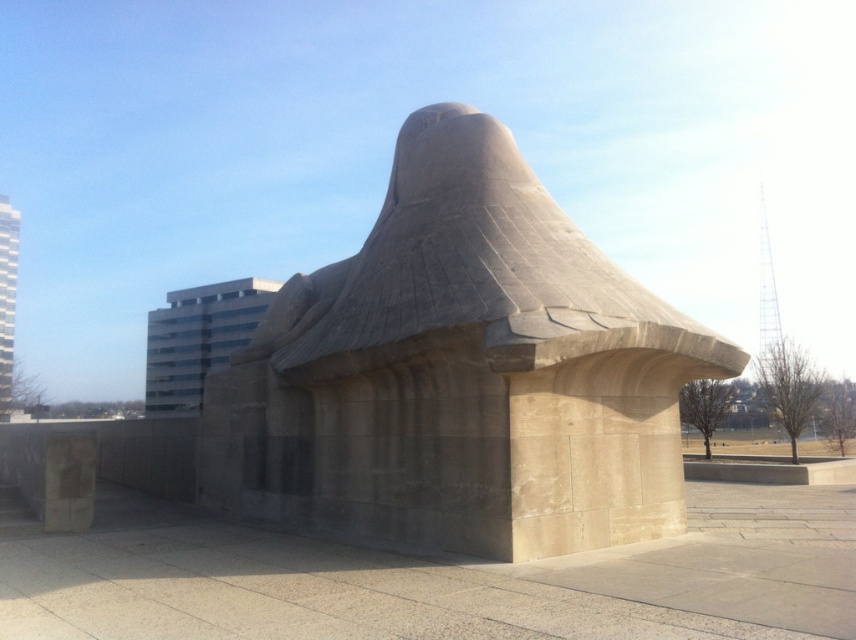
Question: Is smooth concrete sculpture at center wider than beige stone wall at center?

Choices:
 (A) yes
 (B) no

Answer: (B)

Question: Does smooth concrete sculpture at center have a lesser width compared to beige stone wall at center?

Choices:
 (A) no
 (B) yes

Answer: (B)

Question: Is smooth concrete sculpture at center to the right of beige stone wall at center from the viewer's perspective?

Choices:
 (A) yes
 (B) no

Answer: (B)

Question: Which object is farther from the camera taking this photo?

Choices:
 (A) smooth concrete sculpture at center
 (B) beige stone wall at center

Answer: (A)